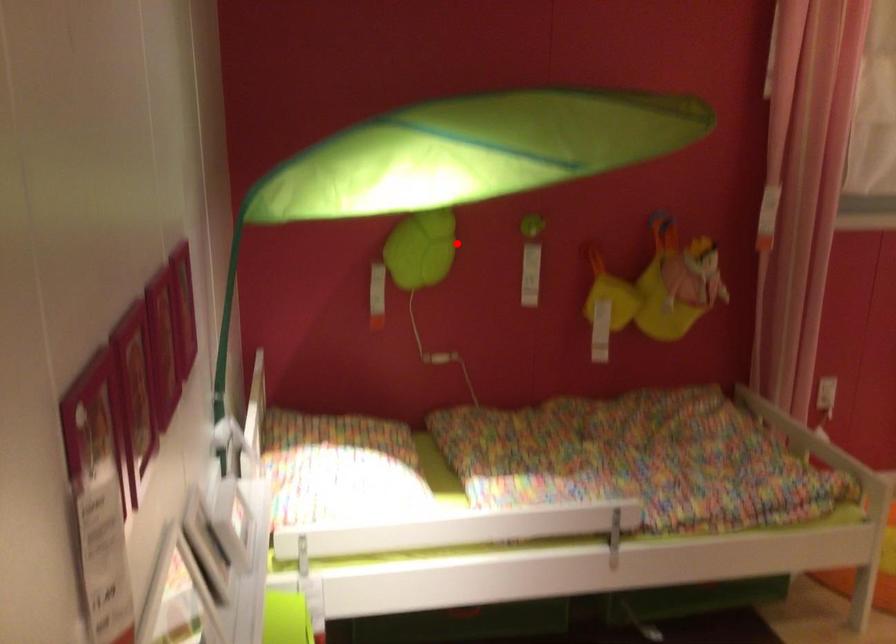
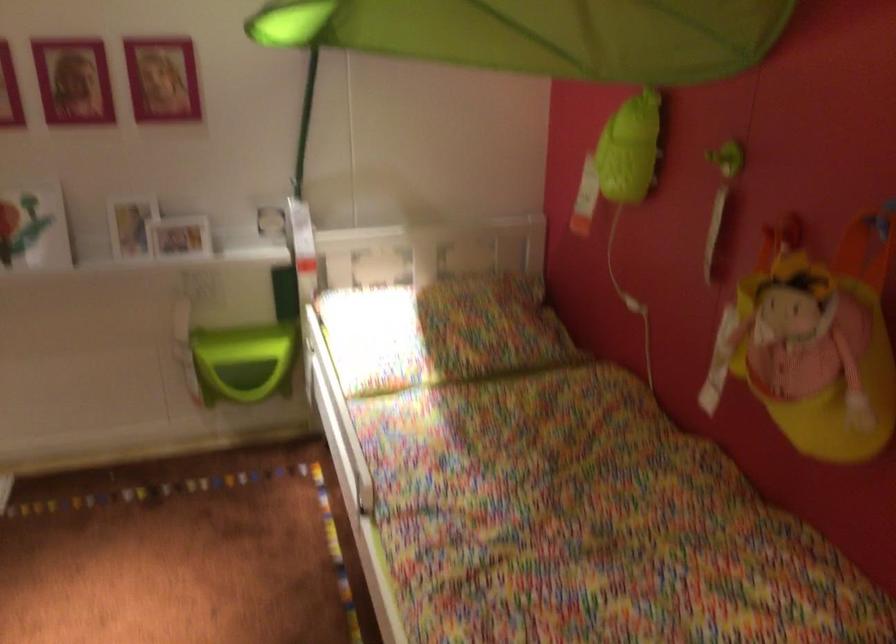
Question: I am providing you with two images of the same scene from different viewpoints. A red point is marked on the first image. Can you still see the location of the red point in image 2?

Choices:
 (A) Yes
 (B) No

Answer: (A)